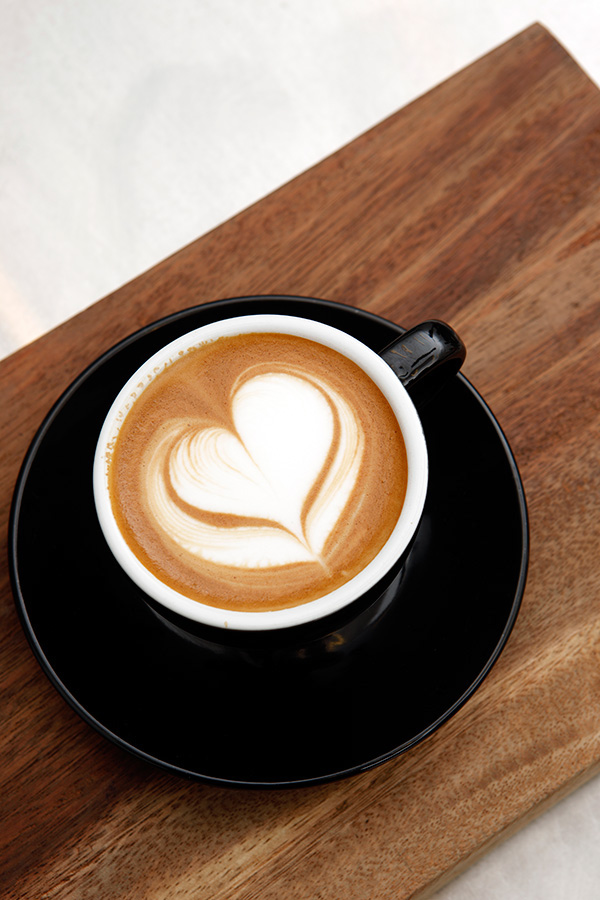
Where is `different shades of wood in the table`? different shades of wood in the table is located at coordinates (268, 849), (114, 798), (422, 834), (490, 257).